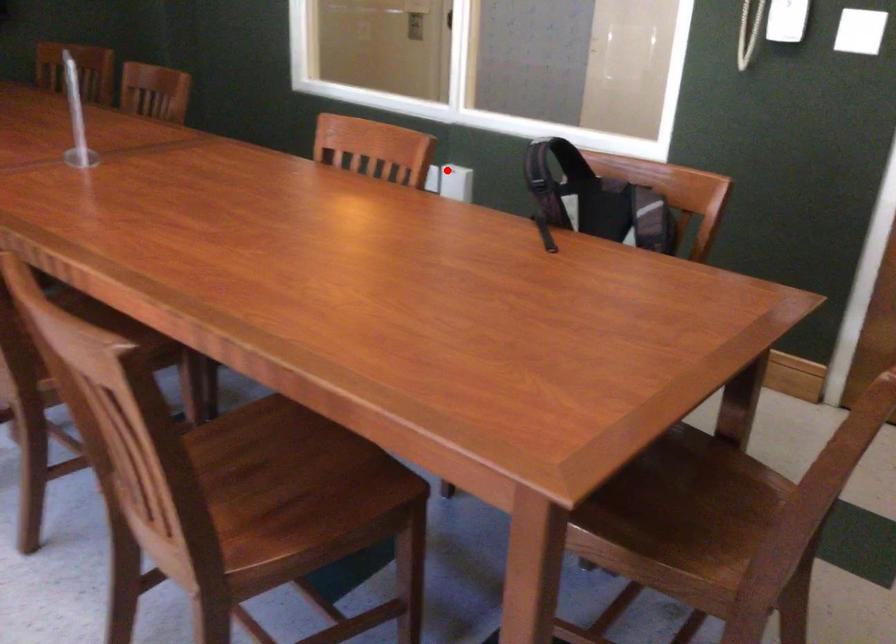
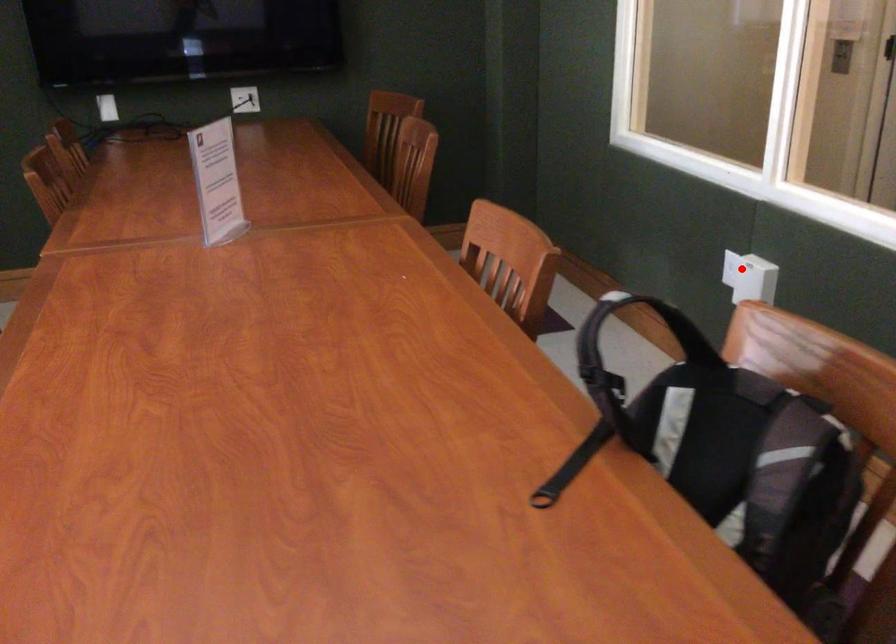
I am providing you with two images of the same scene from different viewpoints. A red point is marked on the first image and another point is marked on the second image. Is the marked point in image1 the same physical position as the marked point in image2?

Yes